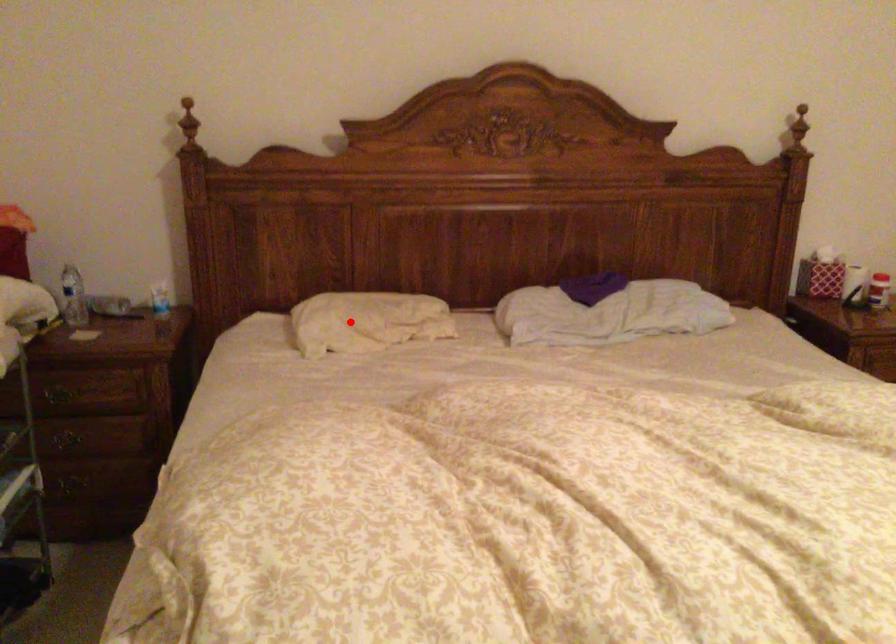
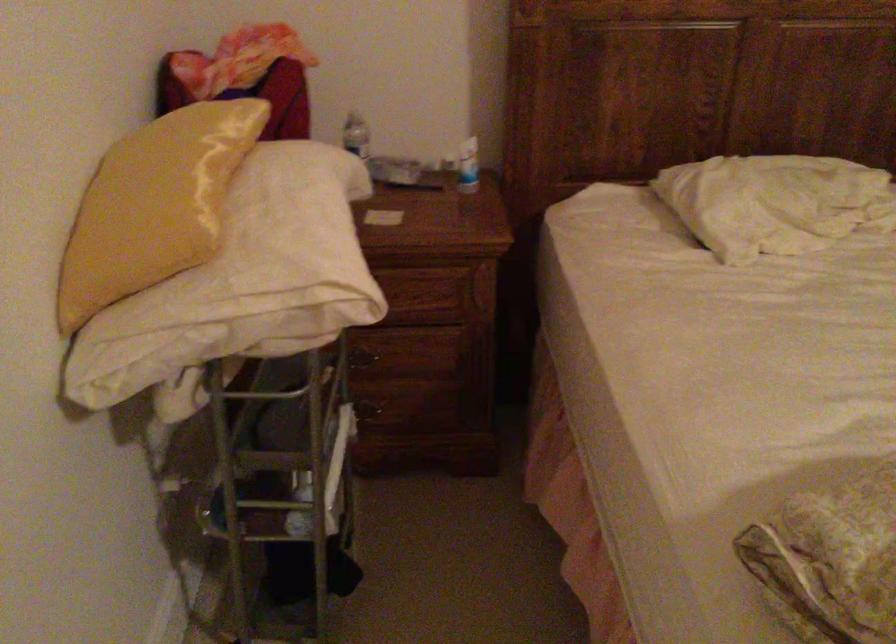
Find the pixel in the second image that matches the highlighted location in the first image.

(774, 202)